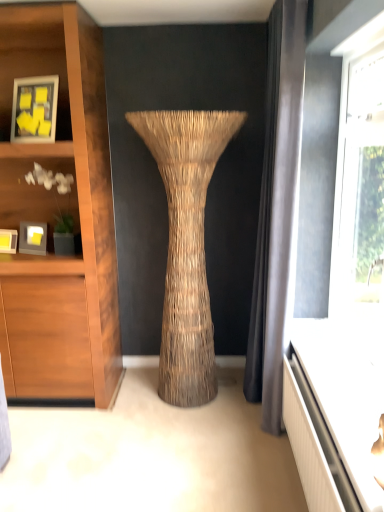
Question: Is point (16, 241) positioned closer to the camera than point (347, 411)?

Choices:
 (A) closer
 (B) farther

Answer: (B)

Question: From a real-world perspective, relative to white glossy vanity at lower right, is matte black picture frame at left, positioned as the 3th picture frame in top-to-bottom order, vertically above or below?

Choices:
 (A) above
 (B) below

Answer: (A)

Question: Which object is the farthest from the black fabric curtain at right?

Choices:
 (A) matte wood shelf at left
 (B) matte black picture frame at left, the first picture frame from the bottom
 (C) matte black picture frame at left, the second picture frame from the bottom
 (D) white glossy vanity at lower right
 (E) matte yellow paper at upper left, which is the first picture frame in top-to-bottom order

Answer: (B)

Question: Which of these objects is positioned closest to the matte yellow paper at upper left, which is the third picture frame in bottom-to-top order?

Choices:
 (A) braided straw vase at center
 (B) black fabric curtain at right
 (C) matte black picture frame at left, the first picture frame from the bottom
 (D) white glossy vanity at lower right
 (E) matte black picture frame at left, the second picture frame when ordered from top to bottom

Answer: (E)